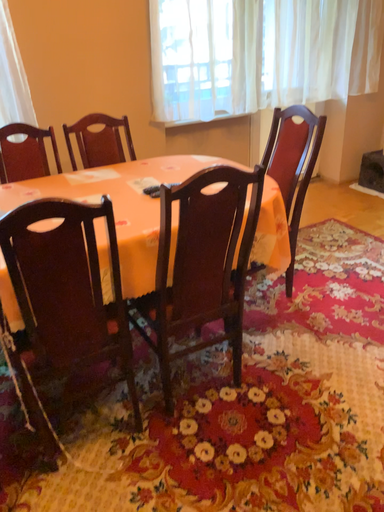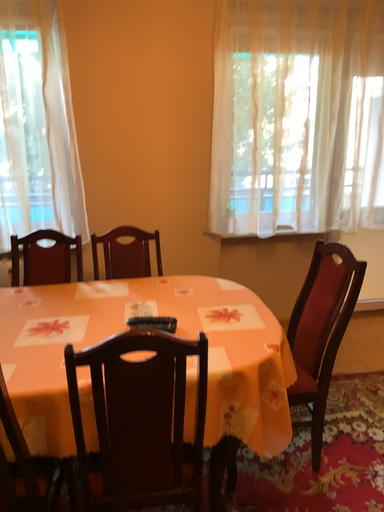
Question: Which way did the camera rotate in the video?

Choices:
 (A) rotated right
 (B) rotated left

Answer: (B)